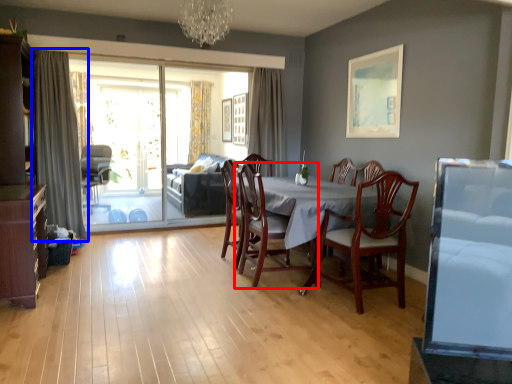
Question: Which object is closer to the camera taking this photo, chair (highlighted by a red box) or curtain (highlighted by a blue box)?

Choices:
 (A) chair
 (B) curtain

Answer: (A)